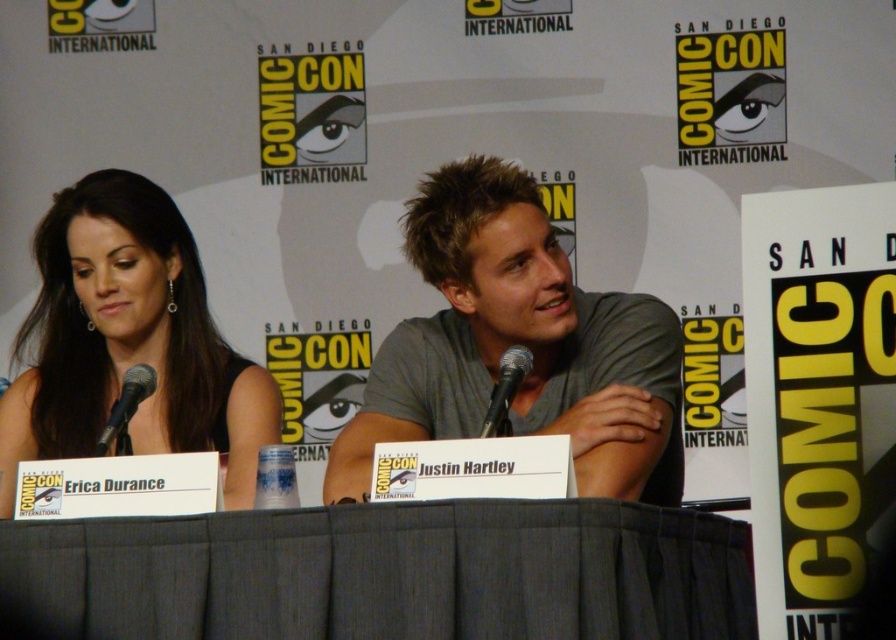
You are attending a panel at San Diego Comic Con and notice two attendees wearing different outfits. The gray cotton shirt at center and the matte black dress at left. Which outfit is smaller in size?

The gray cotton shirt at center has a smaller size compared to the matte black dress at left, so the gray cotton shirt at center is smaller in size.

You are an attendee at San Diego Comic Con and you want to take a photo of the panel discussion. You notice two people on stage wearing the gray cotton shirt at center and the matte black dress at left. Which one is positioned to the right of the other?

The gray cotton shirt at center is positioned to the right of the matte black dress at left.